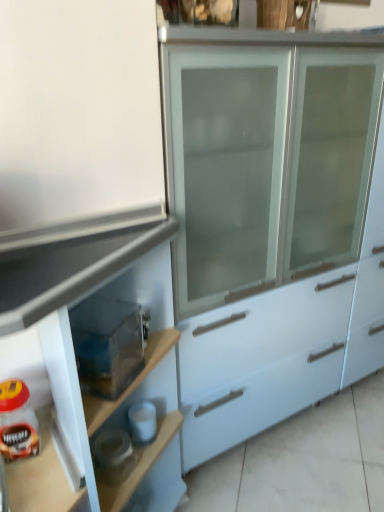
Question: Considering the relative positions of matte white cabinet at center and matte glass jar of coffee at lower left in the image provided, is matte white cabinet at center to the left or to the right of matte glass jar of coffee at lower left?

Choices:
 (A) right
 (B) left

Answer: (A)

Question: Choose the correct answer: Is matte white cabinet at center inside matte glass jar of coffee at lower left or outside it?

Choices:
 (A) outside
 (B) inside

Answer: (A)

Question: Which of these objects is positioned farthest from the matte white cabinet at center?

Choices:
 (A) transparent plastic container at lower left
 (B) matte glass jar of coffee at lower left

Answer: (B)

Question: Which is nearer to the matte white cabinet at center?

Choices:
 (A) matte glass jar of coffee at lower left
 (B) transparent plastic container at lower left

Answer: (B)